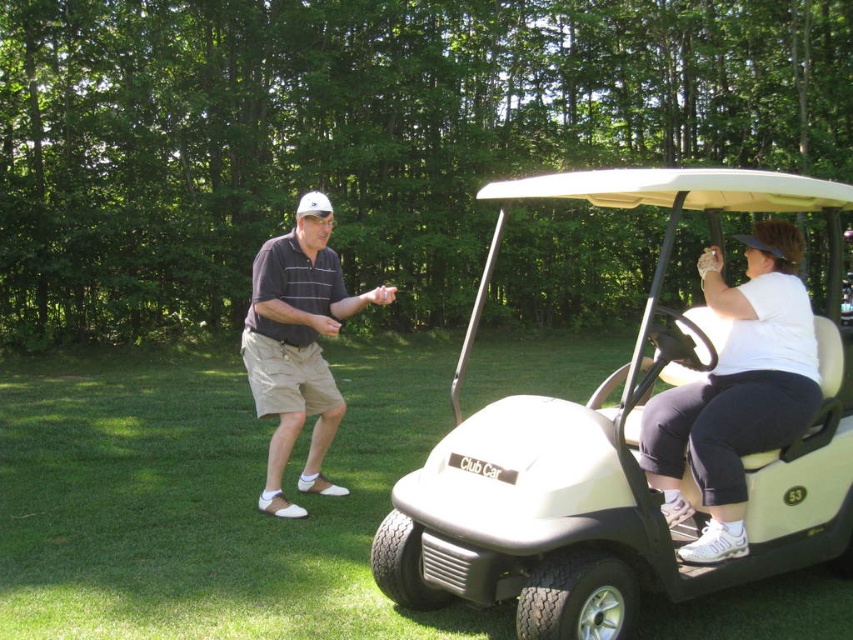
You are standing at the center of the grassy area and want to take a photo of the white plastic golf cart at center. Which direction should you face to ensure the golf cart is in the frame?

Since the white plastic golf cart at center is located at point (204, 500), you should face towards the center of the grassy area to capture it in your photo.

From the picture: You are a photographer positioned in the park and want to capture both the white matte golf cart at right and the white matte shirt at center in a single shot. Based on their positions, which object will appear larger in the photo?

The white matte golf cart at right will appear larger in the photo because it is closer to the viewer than the white matte shirt at center.